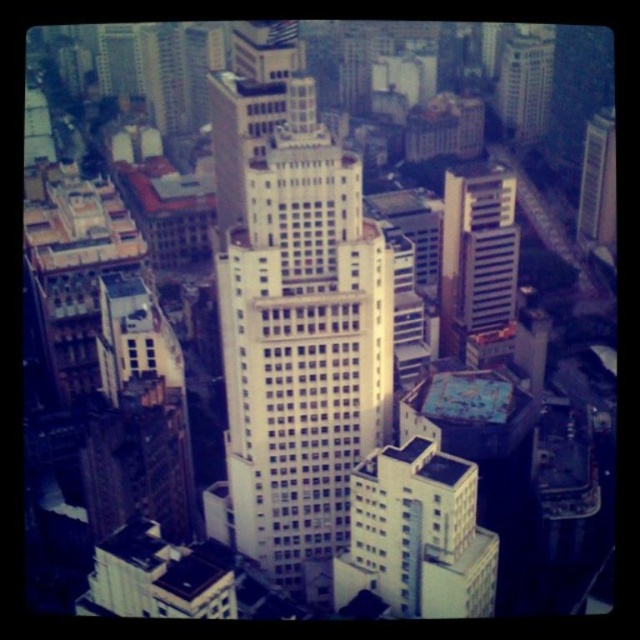
Looking at this image, can you confirm if white smooth building at center is positioned above white glass building at center?

No.

From the picture: Between white smooth building at center and white glass building at center, which one is positioned higher?

Positioned higher is white glass building at center.

Does point (474, 506) come in front of point (460, 198)?

Yes.

Locate an element on the screen. This screenshot has height=640, width=640. white smooth building at center is located at coordinates (417, 536).

Image resolution: width=640 pixels, height=640 pixels. Identify the location of white smooth building at center. (417, 536).

What do you see at coordinates (417, 536) in the screenshot? I see `white smooth building at center` at bounding box center [417, 536].

The image size is (640, 640). Identify the location of white smooth building at center. (417, 536).

Is white glass building at center to the right of metallic glass skyscraper at upper right from the viewer's perspective?

No, white glass building at center is not to the right of metallic glass skyscraper at upper right.

Between white glass building at center and metallic glass skyscraper at upper right, which one is positioned higher?

metallic glass skyscraper at upper right

Who is more distant from viewer, (461, 228) or (598, 124)?

Point (598, 124)

Locate an element on the screen. Image resolution: width=640 pixels, height=640 pixels. white glass building at center is located at coordinates (476, 253).